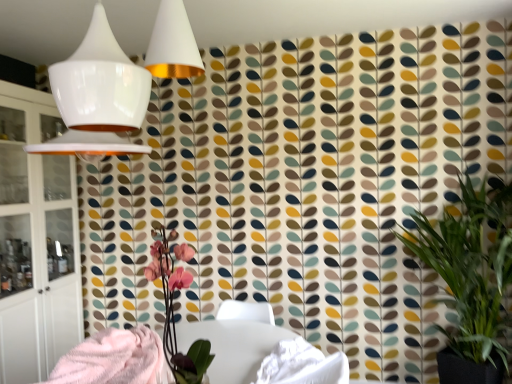
Question: Is fluffy pink blanket at lower left outside of white glass cabinet at left?

Choices:
 (A) no
 (B) yes

Answer: (B)

Question: Does fluffy pink blanket at lower left have a lesser width compared to white glass cabinet at left?

Choices:
 (A) no
 (B) yes

Answer: (A)

Question: From the image's perspective, is fluffy pink blanket at lower left located beneath white glass cabinet at left?

Choices:
 (A) no
 (B) yes

Answer: (B)

Question: Is fluffy pink blanket at lower left aimed at white glass cabinet at left?

Choices:
 (A) yes
 (B) no

Answer: (B)

Question: Considering the relative positions of fluffy pink blanket at lower left and white glass cabinet at left in the image provided, is fluffy pink blanket at lower left behind white glass cabinet at left?

Choices:
 (A) yes
 (B) no

Answer: (B)

Question: Based on their sizes in the image, would you say green leafy plant at right is bigger or smaller than fluffy pink blanket at lower left?

Choices:
 (A) small
 (B) big

Answer: (B)

Question: Does point (462, 357) appear closer or farther from the camera than point (158, 374)?

Choices:
 (A) farther
 (B) closer

Answer: (A)

Question: Considering the positions of green leafy plant at right and fluffy pink blanket at lower left in the image, is green leafy plant at right wider or thinner than fluffy pink blanket at lower left?

Choices:
 (A) wide
 (B) thin

Answer: (A)

Question: Is green leafy plant at right situated inside fluffy pink blanket at lower left or outside?

Choices:
 (A) outside
 (B) inside

Answer: (A)

Question: Would you say white glossy table at center is to the left or to the right of pink matte orchid at center in the picture?

Choices:
 (A) right
 (B) left

Answer: (A)

Question: Looking at the image, does white glossy table at center seem bigger or smaller compared to pink matte orchid at center?

Choices:
 (A) small
 (B) big

Answer: (B)

Question: From the image's perspective, is white glossy table at center positioned above or below pink matte orchid at center?

Choices:
 (A) above
 (B) below

Answer: (B)

Question: Is white glossy table at center inside the boundaries of pink matte orchid at center, or outside?

Choices:
 (A) inside
 (B) outside

Answer: (B)

Question: Relative to fluffy pink blanket at lower left, is white glossy table at center in front or behind?

Choices:
 (A) front
 (B) behind

Answer: (B)

Question: In terms of height, does white glossy table at center look taller or shorter compared to fluffy pink blanket at lower left?

Choices:
 (A) short
 (B) tall

Answer: (B)